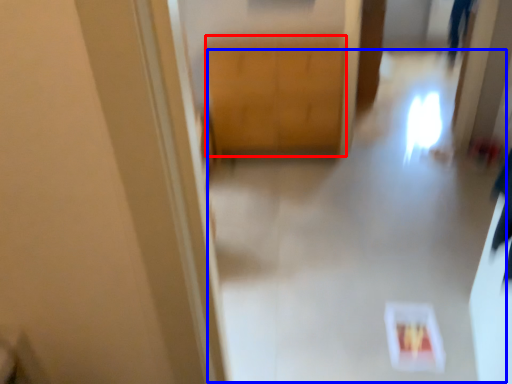
Question: Which point is further to the camera, cabinetry (highlighted by a red box) or path (highlighted by a blue box)?

Choices:
 (A) cabinetry
 (B) path

Answer: (A)